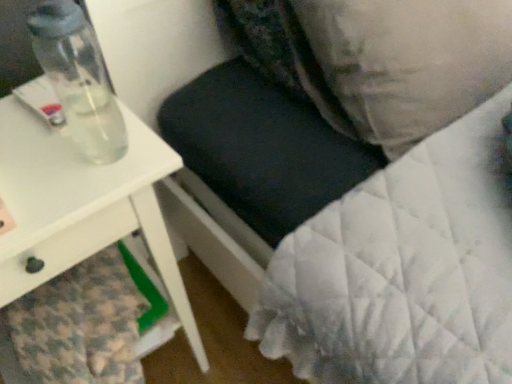
Question: Does white glossy table at left have a lesser width compared to velvety black pillow at upper center, positioned as the 2th pillow in right-to-left order?

Choices:
 (A) no
 (B) yes

Answer: (A)

Question: Can you confirm if white glossy table at left is taller than velvety black pillow at upper center, the first pillow from the left?

Choices:
 (A) yes
 (B) no

Answer: (A)

Question: Is white glossy table at left not close to velvety black pillow at upper center, the first pillow from the left?

Choices:
 (A) no
 (B) yes

Answer: (A)

Question: Is white glossy table at left positioned before velvety black pillow at upper center, positioned as the 2th pillow in right-to-left order?

Choices:
 (A) no
 (B) yes

Answer: (B)

Question: Can velvety black pillow at upper center, positioned as the 2th pillow in right-to-left order, be found inside white glossy table at left?

Choices:
 (A) no
 (B) yes

Answer: (A)

Question: Which is correct: white quilted pillow at upper right, the 2th pillow when ordered from left to right, is inside white glossy table at left, or outside of it?

Choices:
 (A) inside
 (B) outside

Answer: (B)

Question: Considering the relative positions of white quilted pillow at upper right, arranged as the first pillow when viewed from the right, and white glossy table at left in the image provided, is white quilted pillow at upper right, arranged as the first pillow when viewed from the right, to the left or to the right of white glossy table at left?

Choices:
 (A) left
 (B) right

Answer: (B)

Question: From the image's perspective, relative to white glossy table at left, is white quilted pillow at upper right, the 2th pillow when ordered from left to right, above or below?

Choices:
 (A) above
 (B) below

Answer: (A)

Question: In the image, is white quilted pillow at upper right, arranged as the first pillow when viewed from the right, positioned in front of or behind white glossy table at left?

Choices:
 (A) front
 (B) behind

Answer: (B)

Question: Would you say white quilted pillow at upper right, arranged as the first pillow when viewed from the right, is inside or outside velvety black pillow at upper center, the first pillow from the left?

Choices:
 (A) outside
 (B) inside

Answer: (A)

Question: Is white quilted pillow at upper right, arranged as the first pillow when viewed from the right, bigger or smaller than velvety black pillow at upper center, positioned as the 2th pillow in right-to-left order?

Choices:
 (A) big
 (B) small

Answer: (A)

Question: Relative to velvety black pillow at upper center, the first pillow from the left, is white quilted pillow at upper right, the 2th pillow when ordered from left to right, in front or behind?

Choices:
 (A) front
 (B) behind

Answer: (A)

Question: Considering the positions of white quilted pillow at upper right, the 2th pillow when ordered from left to right, and velvety black pillow at upper center, positioned as the 2th pillow in right-to-left order, in the image, is white quilted pillow at upper right, the 2th pillow when ordered from left to right, wider or thinner than velvety black pillow at upper center, positioned as the 2th pillow in right-to-left order,?

Choices:
 (A) thin
 (B) wide

Answer: (B)

Question: From the image's perspective, is velvety black pillow at upper center, positioned as the 2th pillow in right-to-left order, above or below white quilted pillow at upper right, arranged as the first pillow when viewed from the right?

Choices:
 (A) above
 (B) below

Answer: (A)

Question: Is point (253, 16) positioned closer to the camera than point (344, 59)?

Choices:
 (A) farther
 (B) closer

Answer: (A)